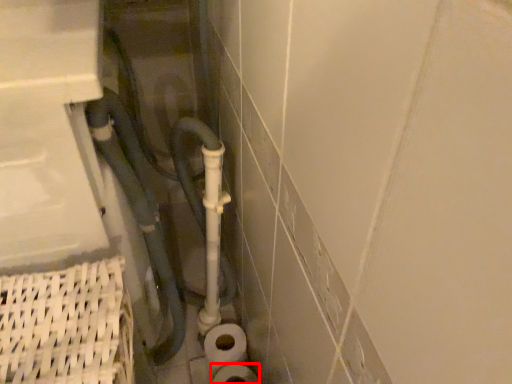
Question: In this image, where is toilet paper (annotated by the red box) located relative to water pipe?

Choices:
 (A) right
 (B) left

Answer: (A)